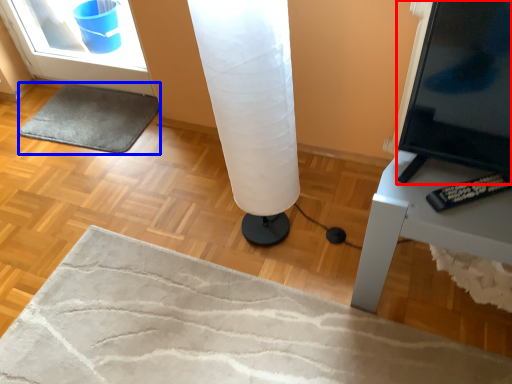
Question: Among these objects, which one is nearest to the camera, screen (highlighted by a red box) or yoga mat (highlighted by a blue box)?

Choices:
 (A) screen
 (B) yoga mat

Answer: (A)